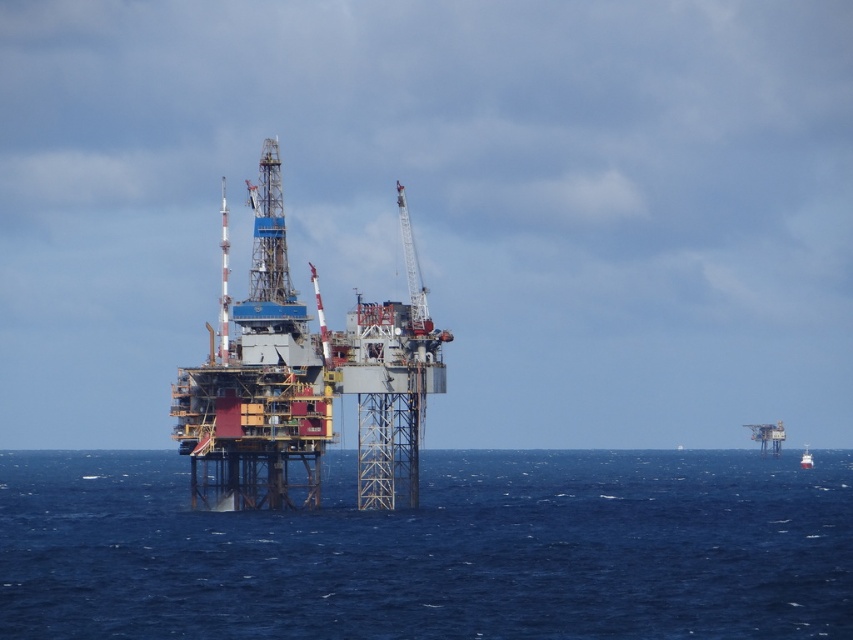
Is blue water at center bigger than red glossy boat at far right?

Indeed, blue water at center has a larger size compared to red glossy boat at far right.

What do you see at coordinates (434, 548) in the screenshot?
I see `blue water at center` at bounding box center [434, 548].

At what (x,y) coordinates should I click in order to perform the action: click on blue water at center. Please return your answer as a coordinate pair (x, y). The image size is (853, 640). Looking at the image, I should click on pyautogui.click(x=434, y=548).